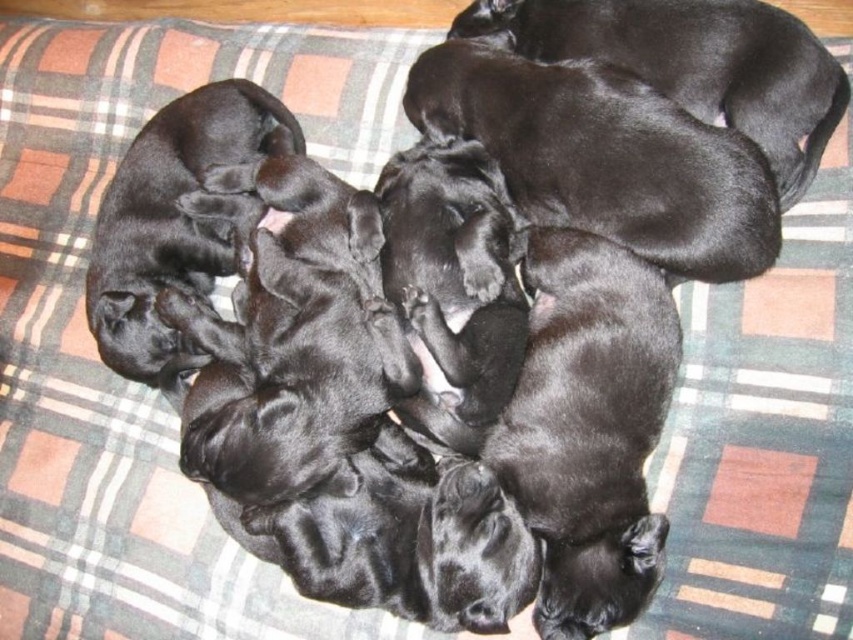
You are a photographer trying to capture the black smooth fur puppies at center and the shiny black puppies at upper right in a single shot. Based on their positions, which puppies are located closer to the left side of the frame?

The black smooth fur puppies at center are located to the left of the shiny black puppies at upper right, so they are closer to the left side of the frame.

You are standing 1 meter away from a plaid blanket with black puppies. There is a point at coordinates point (689,45). Can you reach that point without moving closer to the blanket?

The distance of point (689,45) from viewer is 1.18 meters, so since you are standing 1 meter away, the point is 0.18 meters further away. You cannot reach it without moving closer to the blanket.

Please look at the image and locate the point at coordinates (695, 64). What object is at this point?

The point at coordinates (695, 64) is where the shiny black puppies at upper right are located.